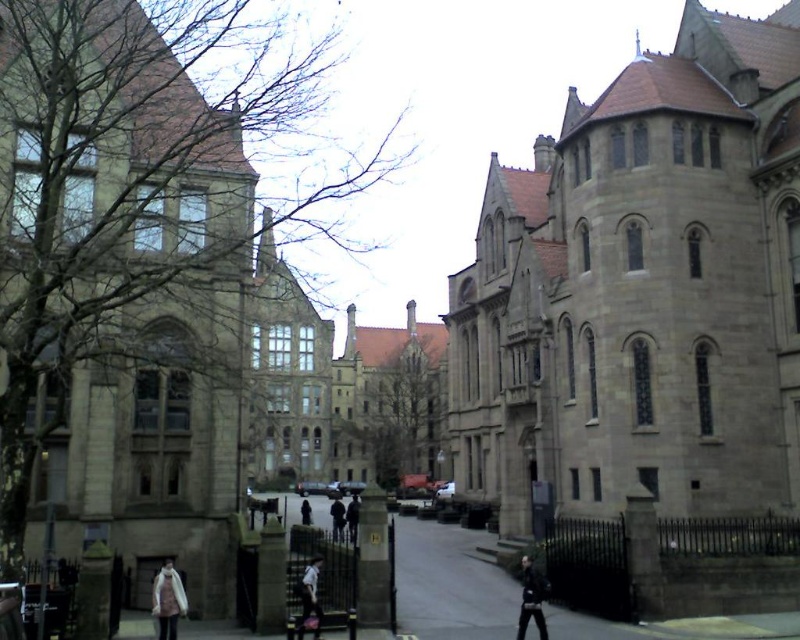
Is bare branches at upper left to the left of dark gray jacket at center from the viewer's perspective?

Correct, you'll find bare branches at upper left to the left of dark gray jacket at center.

Is bare branches at upper left above dark gray jacket at center?

Yes, bare branches at upper left is above dark gray jacket at center.

Which is in front, point (208, 214) or point (350, 508)?

Positioned in front is point (208, 214).

You are a GUI agent. You are given a task and a screenshot of the screen. Output one action in this format:
    pyautogui.click(x=<x>, y=<y>)
    Task: Click on the bare branches at upper left
    The height and width of the screenshot is (640, 800).
    Given the screenshot: What is the action you would take?
    pyautogui.click(x=137, y=252)

Locate an element on the screen. bare branches at upper left is located at coordinates (137, 252).

Is bare branches at upper left above dark blue jeans at center?

Indeed, bare branches at upper left is positioned over dark blue jeans at center.

From the picture: Who is more distant from viewer, [144,182] or [336,538]?

The point [144,182] is behind.

The width and height of the screenshot is (800, 640). I want to click on bare branches at upper left, so click(x=137, y=252).

This screenshot has width=800, height=640. Describe the element at coordinates (137, 252) in the screenshot. I see `bare branches at upper left` at that location.

Between point (32, 19) and point (164, 580), which one is positioned behind?

The point (32, 19) is more distant.

I want to click on bare branches at upper left, so click(137, 252).